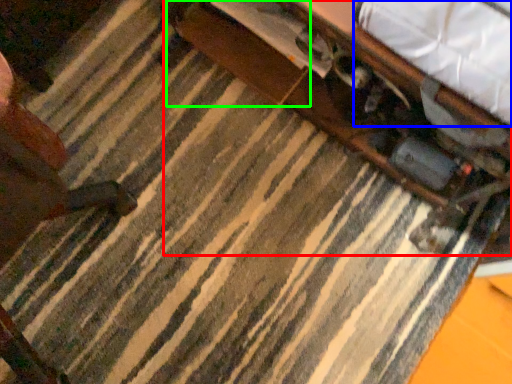
Question: Estimate the real-world distances between objects in this image. Which object is farther from table (highlighted by a red box), sheet (highlighted by a blue box) or drawer (highlighted by a green box)?

Choices:
 (A) sheet
 (B) drawer

Answer: (A)